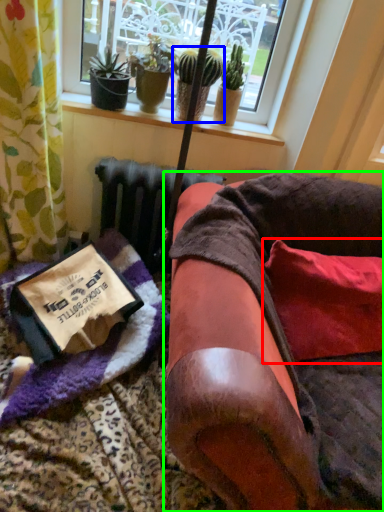
Question: Considering the real-world distances, which object is farthest from pillow (highlighted by a red box)? houseplant (highlighted by a blue box) or furniture (highlighted by a green box)?

Choices:
 (A) houseplant
 (B) furniture

Answer: (A)